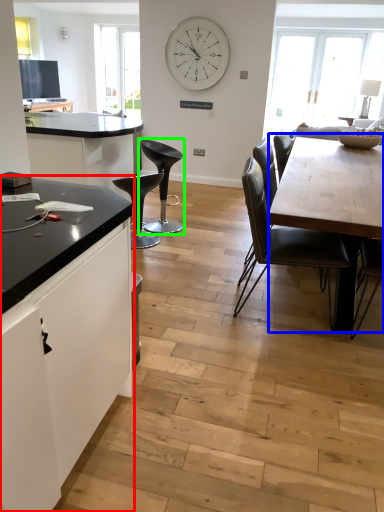
Question: Based on their relative distances, which object is nearer to cabinetry (highlighted by a red box)? Choose from round table (highlighted by a blue box) and chair (highlighted by a green box).

Choices:
 (A) round table
 (B) chair

Answer: (A)